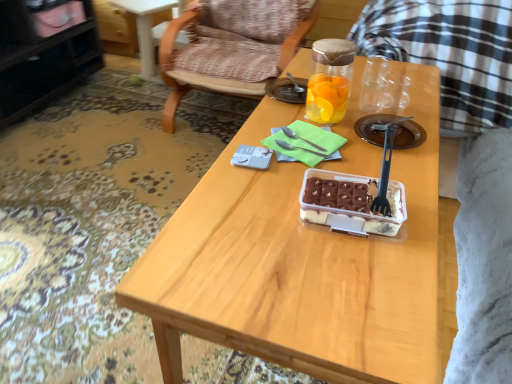
The image size is (512, 384). Identify the location of free location to the right of translucent plastic container at center. (422, 206).